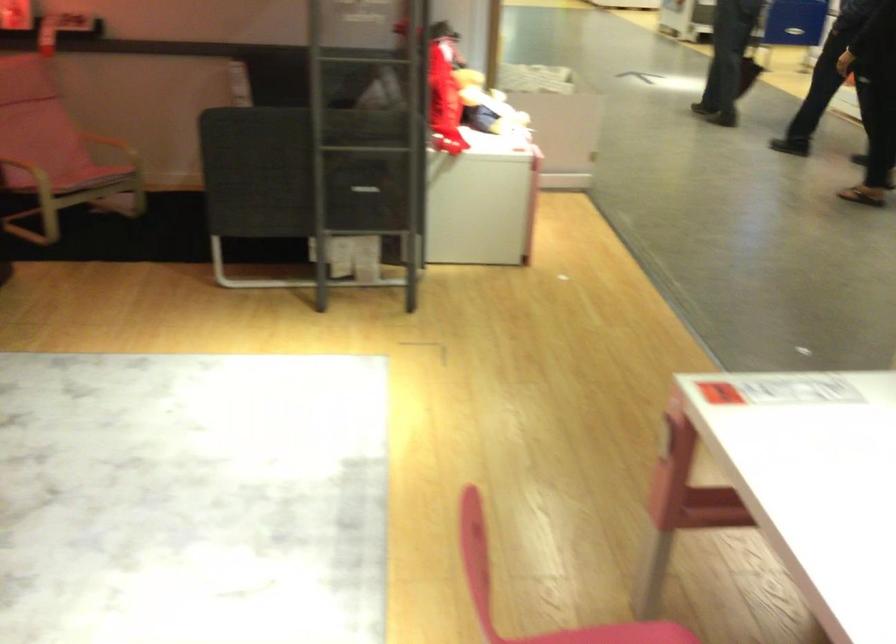
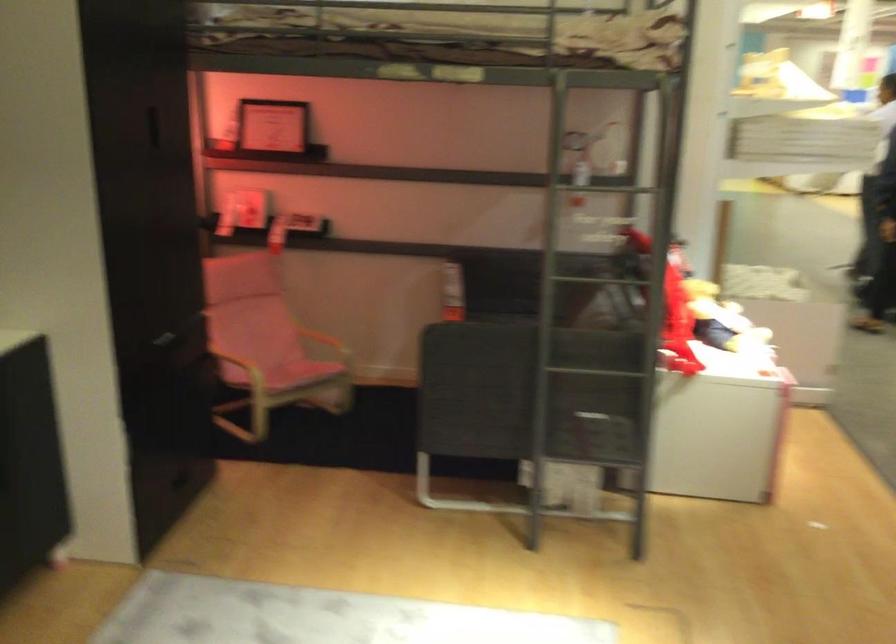
The point at (385,234) is marked in the first image. Where is the corresponding point in the second image?

(607, 462)